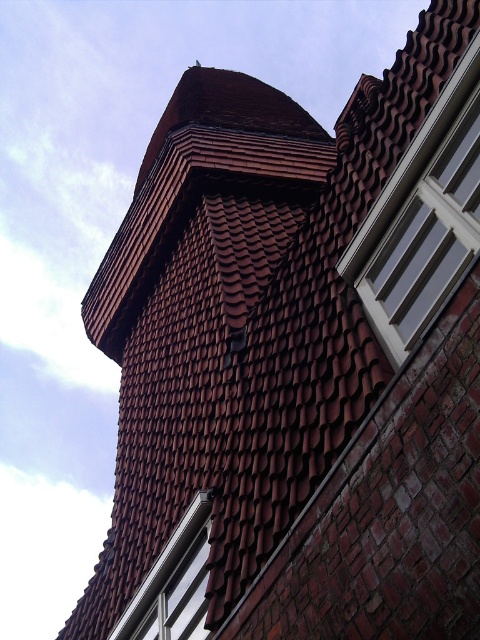
You are a window installer working on a building. You need to install a new window that is 50 feet wide. You see the white glossy window at upper right and the white plastic window at lower left. Can the new window fit between them?

The distance between the white glossy window at upper right and the white plastic window at lower left is 54.40 feet. Since the new window is 50 feet wide, it can fit between them as there is enough space.

In the scene shown: You are a window installer assessing the building. You need to replace the white plastic window at lower left with a new one that matches the white glossy window at upper right. Based on their positions, which window should be installed higher up?

The white glossy window at upper right should be installed higher up because it is located above the white plastic window at lower left.

You are standing 30 meters away from the building. You want to know if you can see the point at coordinates point (388, 259) clearly. Can you see it?

The point (388, 259) is 26.04 meters away from the viewer. Since you are standing 30 meters away, you are farther than the point, so you cannot see it clearly.